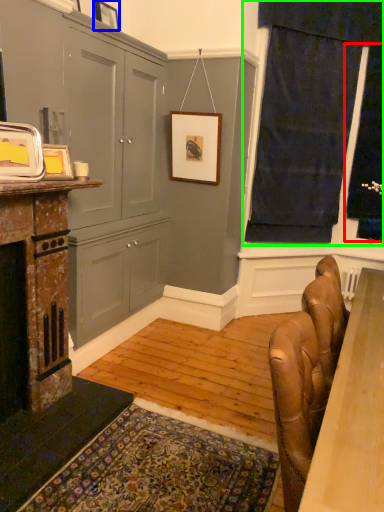
Question: Based on their relative distances, which object is farther from window screen (highlighted by a red box)? Choose from picture frame (highlighted by a blue box) and curtain (highlighted by a green box).

Choices:
 (A) picture frame
 (B) curtain

Answer: (A)